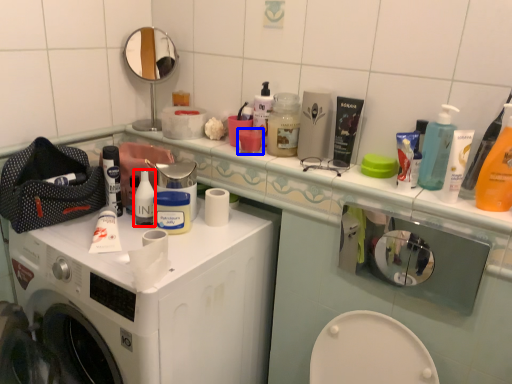
Question: Which point is further to the camera, mouthwash (highlighted by a red box) or mouthwash (highlighted by a blue box)?

Choices:
 (A) mouthwash
 (B) mouthwash

Answer: (B)